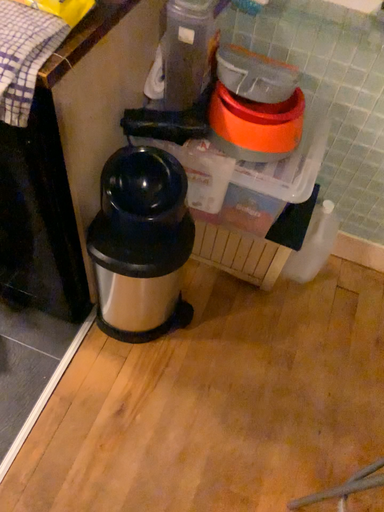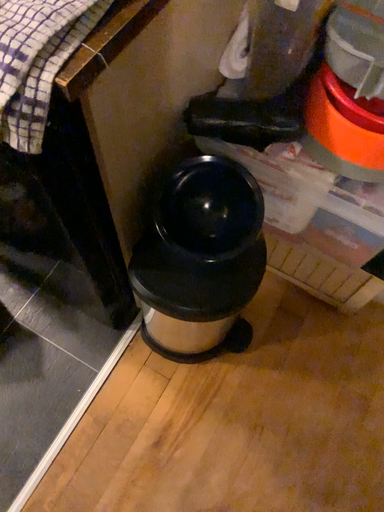
Question: How did the camera likely rotate when shooting the video?

Choices:
 (A) rotated left
 (B) rotated right

Answer: (A)